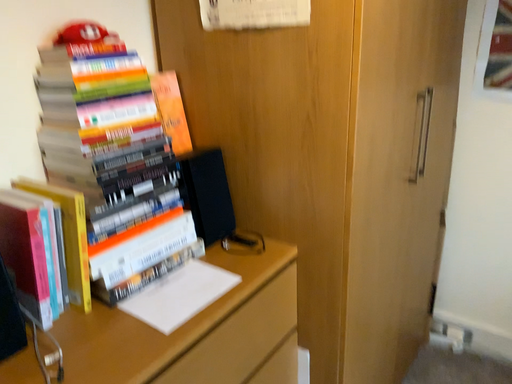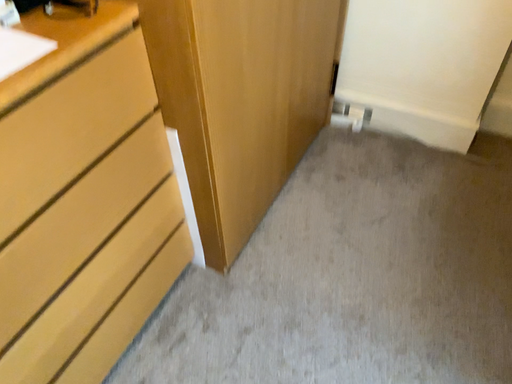
Question: How did the camera likely rotate when shooting the video?

Choices:
 (A) rotated left
 (B) rotated right

Answer: (B)